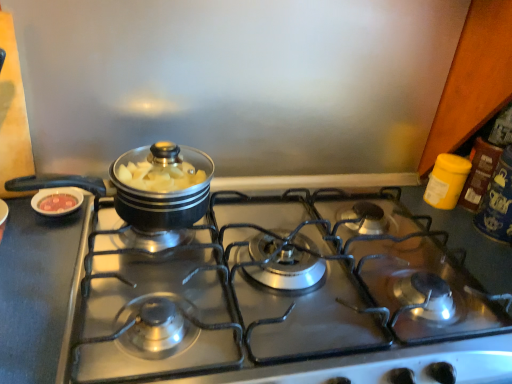
This screenshot has height=384, width=512. I want to click on stainless steel gas stove at center, so click(x=281, y=299).

The width and height of the screenshot is (512, 384). What do you see at coordinates (281, 299) in the screenshot?
I see `stainless steel gas stove at center` at bounding box center [281, 299].

What are the coordinates of `stainless steel gas stove at center` in the screenshot? It's located at (281, 299).